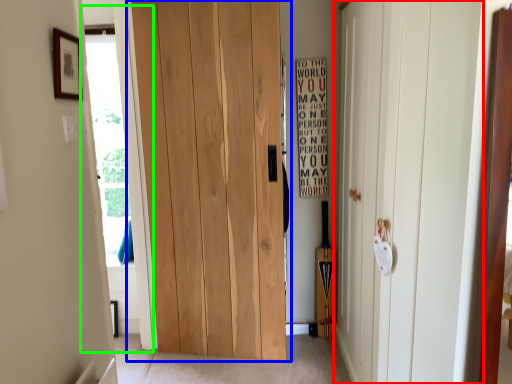
Question: Estimate the real-world distances between objects in this image. Which object is closer to door (highlighted by a red box), door (highlighted by a blue box) or glass door (highlighted by a green box)?

Choices:
 (A) door
 (B) glass door

Answer: (A)